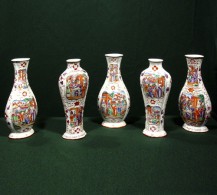
Locate an element on the screen. green wall is located at coordinates (132, 44).